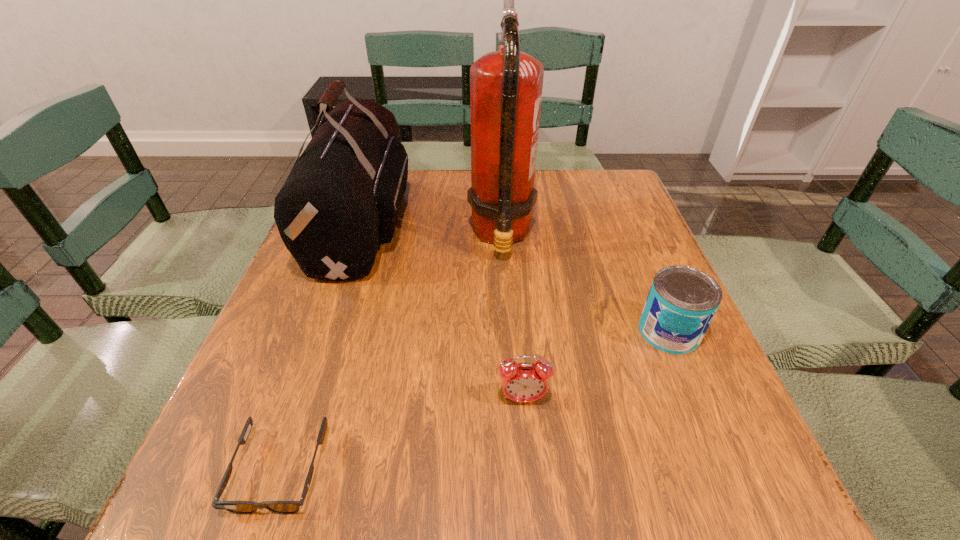
Locate an element on the screen. This screenshot has width=960, height=540. free space between the second tallest object and the nearest object is located at coordinates (322, 346).

Locate an element on the screen. free point between the can and the duffel bag is located at coordinates (516, 277).

Find the location of a particular element. empty location between the fourth farthest object and the nearest object is located at coordinates (401, 435).

Find the location of a particular element. The image size is (960, 540). vacant area that lies between the fire extinguisher and the rightmost object is located at coordinates (585, 284).

You are a GUI agent. You are given a task and a screenshot of the screen. Output one action in this format:
    pyautogui.click(x=<x>, y=<y>)
    Task: Click on the free area in between the rightmost object and the duffel bag
    The image size is (960, 540).
    Given the screenshot: What is the action you would take?
    pyautogui.click(x=516, y=277)

The image size is (960, 540). In order to click on object that stands as the second closest to the sunglasses in this screenshot , I will do `click(341, 200)`.

You are a GUI agent. You are given a task and a screenshot of the screen. Output one action in this format:
    pyautogui.click(x=<x>, y=<y>)
    Task: Click on the object that is the fourth closest to the tallest object
    This screenshot has width=960, height=540.
    Given the screenshot: What is the action you would take?
    pyautogui.click(x=237, y=507)

The width and height of the screenshot is (960, 540). I want to click on free point that satisfies the following two spatial constraints: 1. on the front pocket of the rightmost object; 2. on the right side of the fourth shortest object, so (x=326, y=332).

You are a GUI agent. You are given a task and a screenshot of the screen. Output one action in this format:
    pyautogui.click(x=<x>, y=<y>)
    Task: Click on the vacant space that satisfies the following two spatial constraints: 1. on the front pocket of the second tallest object; 2. on the back side of the third nearest object
    This screenshot has width=960, height=540.
    Given the screenshot: What is the action you would take?
    pyautogui.click(x=326, y=332)

This screenshot has width=960, height=540. Identify the location of vacant space that satisfies the following two spatial constraints: 1. on the back side of the can; 2. at the nozzle of the tallest object. 629,235.